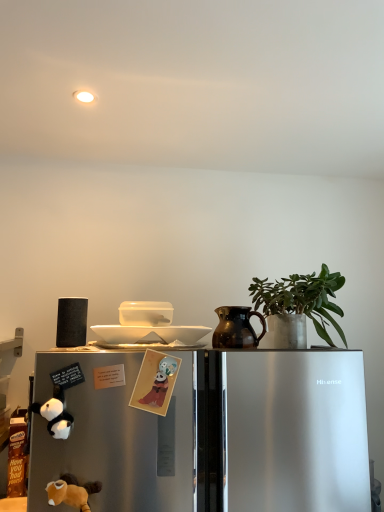
Locate an element on the screen. free space in front of black matte speaker at left, the 1th appliance in the left-to-right sequence is located at coordinates (74, 350).